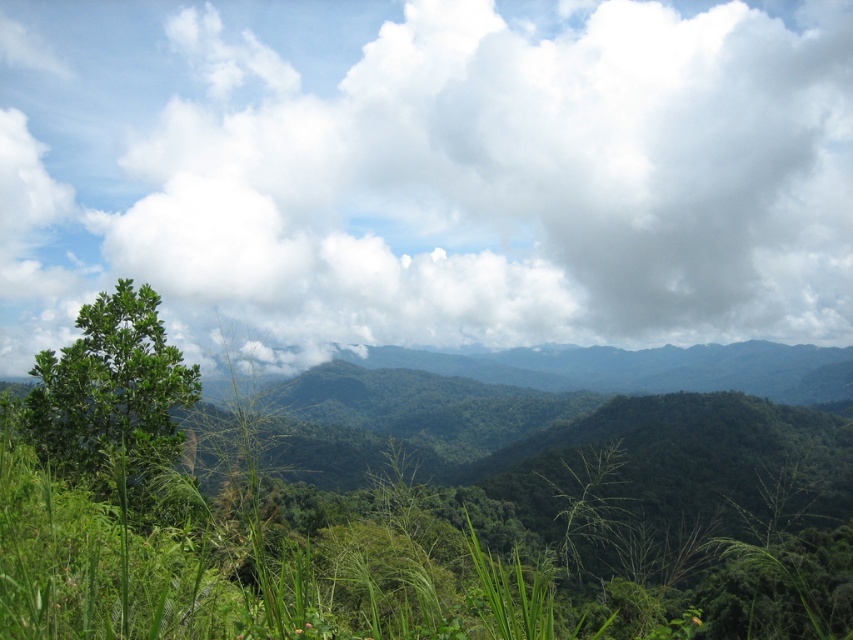
Question: Which of the following is the closest to the observer?

Choices:
 (A) green leafy tree at left
 (B) white fluffy cloud at upper center

Answer: (A)

Question: Which of the following is the closest to the observer?

Choices:
 (A) pyautogui.click(x=134, y=355)
 (B) pyautogui.click(x=527, y=262)

Answer: (A)

Question: In this image, where is white fluffy cloud at upper center located relative to green leafy tree at left?

Choices:
 (A) below
 (B) above

Answer: (B)

Question: Is white fluffy cloud at upper center to the left of green leafy tree at left from the viewer's perspective?

Choices:
 (A) yes
 (B) no

Answer: (B)

Question: Among these points, which one is nearest to the camera?

Choices:
 (A) (100, 444)
 (B) (318, 33)

Answer: (A)

Question: Does white fluffy cloud at upper center appear on the left side of green leafy tree at left?

Choices:
 (A) yes
 (B) no

Answer: (B)